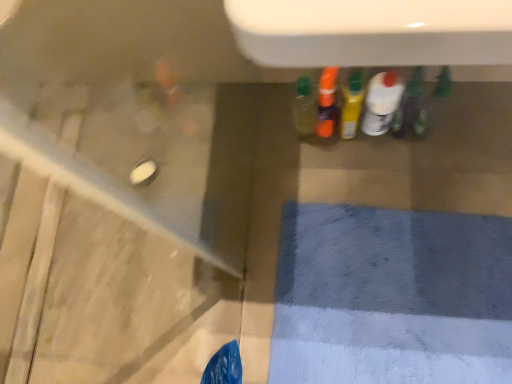
At what (x,y) coordinates should I click in order to perform the action: click on vacant point to the left of translucent plastic bottle at center, arranged as the third bottle when viewed from the right. Please return your answer as a coordinate pair (x, y). Looking at the image, I should click on (301, 155).